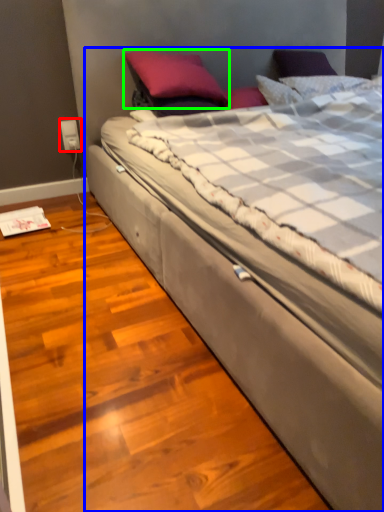
Question: Considering the real-world distances, which object is closest to electric outlet (highlighted by a red box)? bed (highlighted by a blue box) or pillow (highlighted by a green box).

Choices:
 (A) bed
 (B) pillow

Answer: (B)